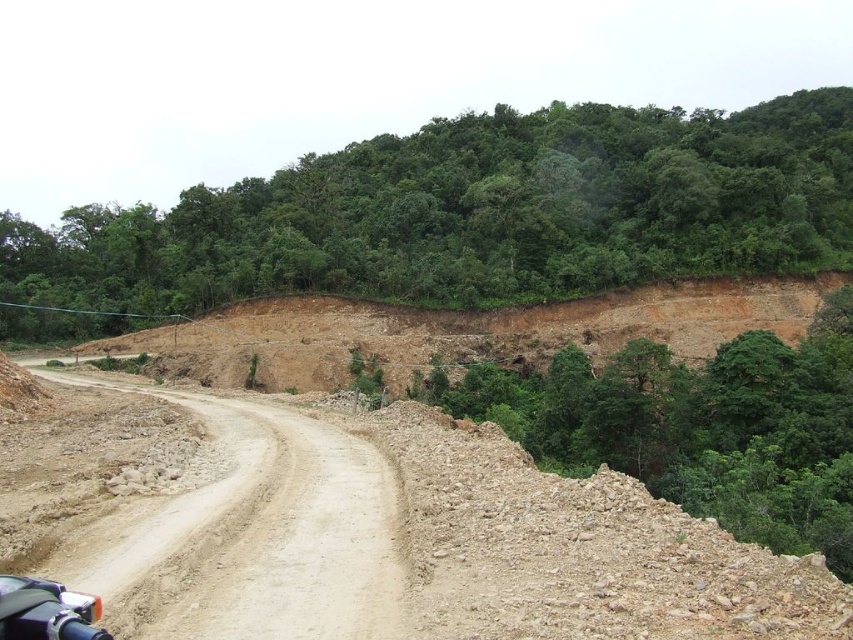
Question: Is green leafy trees at upper center thinner than dirt/gravel road at center?

Choices:
 (A) no
 (B) yes

Answer: (A)

Question: Which point appears closest to the camera in this image?

Choices:
 (A) (234, 461)
 (B) (111, 298)

Answer: (A)

Question: In this image, where is green leafy trees at upper center located relative to dirt/gravel road at center?

Choices:
 (A) left
 (B) right

Answer: (B)

Question: Is green leafy trees at upper center to the right of dirt/gravel road at center from the viewer's perspective?

Choices:
 (A) no
 (B) yes

Answer: (B)

Question: Among these points, which one is farthest from the camera?

Choices:
 (A) (326, 627)
 (B) (189, 260)

Answer: (B)

Question: Among these objects, which one is nearest to the camera?

Choices:
 (A) green leafy trees at upper center
 (B) dirt/gravel road at center

Answer: (B)